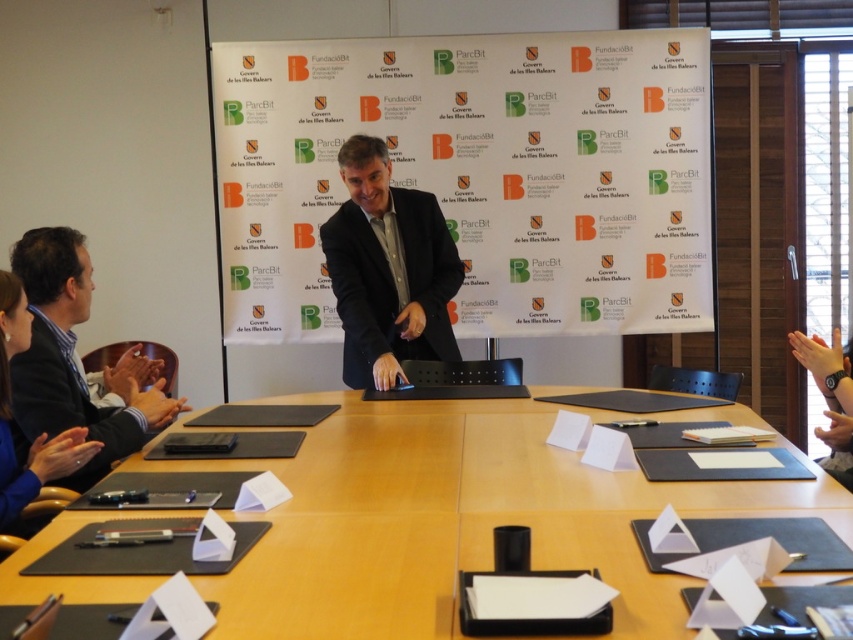
Is point (498, 422) positioned in front of point (436, 266)?

Yes, point (498, 422) is closer to viewer.

Who is taller, wooden table at center or black matte suit at center?

black matte suit at center

Is point (357, 442) farther from camera compared to point (386, 268)?

No, it is not.

The image size is (853, 640). In order to click on wooden table at center in this screenshot , I will do `click(457, 518)`.

Can you confirm if white paperboard at center is positioned to the right of wooden table at center?

Correct, you'll find white paperboard at center to the right of wooden table at center.

Who is more distant from viewer, (674, 330) or (383, 522)?

The point (674, 330) is behind.

Is point (334, 308) positioned after point (332, 419)?

Yes, point (334, 308) is behind point (332, 419).

I want to click on white paperboard at center, so click(x=477, y=173).

Is point (553, 561) positioned after point (7, 280)?

No, it is in front of (7, 280).

Who is higher up, wooden table at center or blue fabric shirt at lower left?

blue fabric shirt at lower left is above.

Which is behind, point (556, 484) or point (10, 292)?

Point (10, 292)

The height and width of the screenshot is (640, 853). What are the coordinates of `wooden table at center` in the screenshot? It's located at (457, 518).